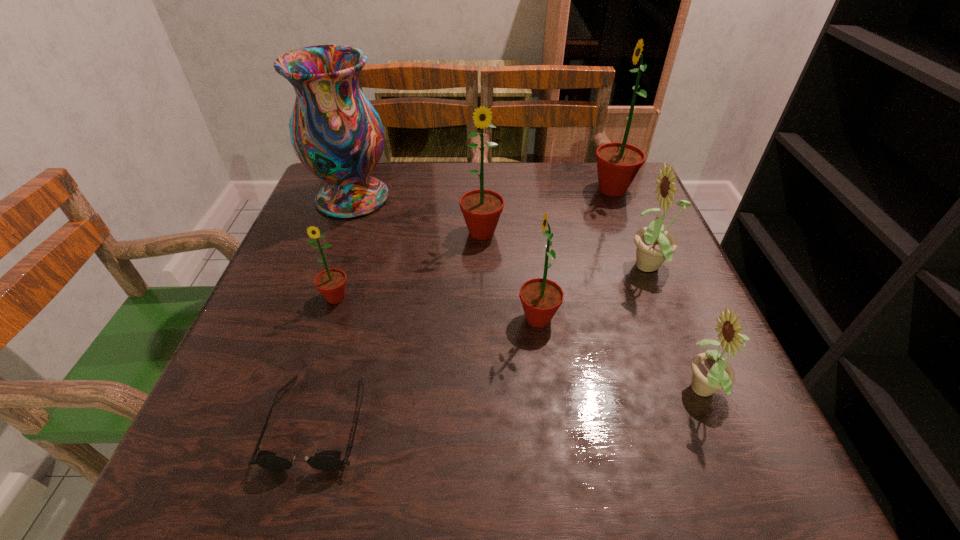
The image size is (960, 540). I want to click on free space located 0.370m on the front-facing side of the farther yellow sunflower, so [445, 268].

This screenshot has height=540, width=960. What are the coordinates of `vacant space positioned 0.200m on the face of the fifth object from left to right` in the screenshot? It's located at (410, 319).

This screenshot has width=960, height=540. In order to click on free space located 0.270m on the face of the fifth object from left to right in this screenshot , I will do `click(372, 319)`.

Locate an element on the screen. This screenshot has width=960, height=540. free space located 0.230m on the face of the fifth object from left to right is located at coordinates (394, 319).

This screenshot has height=540, width=960. I want to click on free space located 0.300m on the front-facing side of the nearer yellow sunflower, so click(493, 392).

Locate an element on the screen. The height and width of the screenshot is (540, 960). blank space located 0.120m on the front-facing side of the nearer yellow sunflower is located at coordinates (605, 392).

Image resolution: width=960 pixels, height=540 pixels. I want to click on blank space located 0.250m on the front-facing side of the nearer yellow sunflower, so click(524, 392).

Find the location of `free location located on the face of the smallest green sunflower`. free location located on the face of the smallest green sunflower is located at coordinates (299, 415).

Where is `sunflower positioned at the far edge`? The image size is (960, 540). sunflower positioned at the far edge is located at coordinates (617, 163).

At what (x,y) coordinates should I click in order to perform the action: click on vase that is positioned at the far edge. Please return your answer as a coordinate pair (x, y). Looking at the image, I should click on (337, 134).